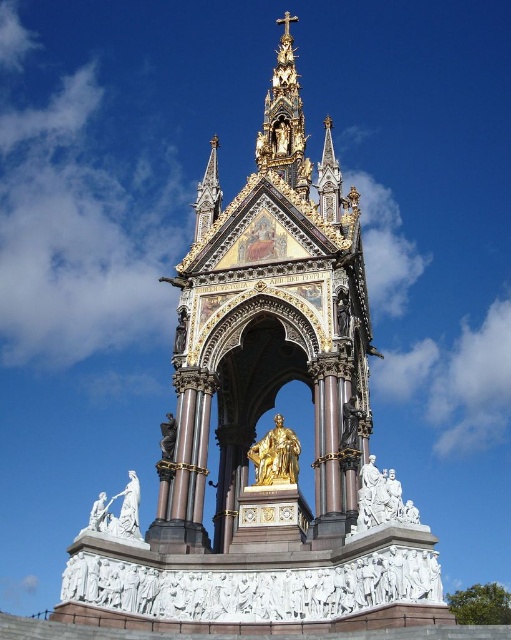
Who is taller, white marble statues at lower right or gold polished statue at center?

With more height is white marble statues at lower right.

Is white marble statues at lower right thinner than gold polished statue at center?

No.

Between point (360, 515) and point (287, 435), which one is positioned behind?

The point (287, 435) is behind.

Find the location of a particular element. The height and width of the screenshot is (640, 511). white marble statues at lower right is located at coordinates tap(381, 499).

Can you confirm if white marble statue at lower left is positioned above bronze statue at center?

Actually, white marble statue at lower left is below bronze statue at center.

Does point (118, 524) come farther from viewer compared to point (164, 451)?

No, it is not.

Find the location of a particular element. This screenshot has width=511, height=640. white marble statue at lower left is located at coordinates (127, 509).

The image size is (511, 640). In order to click on white marble statue at lower left in this screenshot , I will do `click(127, 509)`.

Can you confirm if white marble statues at lower right is taller than white marble statue at lower left?

→ Indeed, white marble statues at lower right has a greater height compared to white marble statue at lower left.

Consider the image. Measure the distance between white marble statues at lower right and camera.

35.22 meters

Where is `white marble statues at lower right`? white marble statues at lower right is located at coordinates (381, 499).